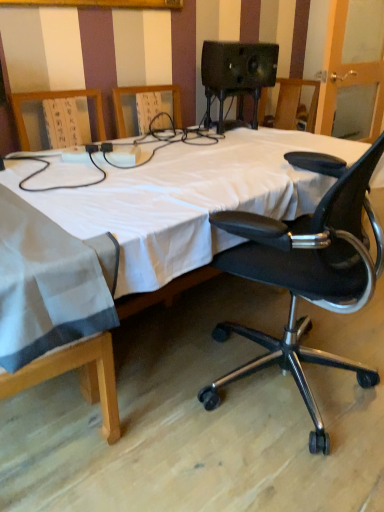
Question: Is white fabric bed at center to the left or to the right of black matte office chair at right in the image?

Choices:
 (A) right
 (B) left

Answer: (B)

Question: From a real-world perspective, is white fabric bed at center positioned above or below black matte office chair at right?

Choices:
 (A) above
 (B) below

Answer: (B)

Question: Relative to black matte office chair at right, is white fabric bed at center in front or behind?

Choices:
 (A) behind
 (B) front

Answer: (B)

Question: Considering the positions of black matte office chair at right and white fabric bed at center in the image, is black matte office chair at right wider or thinner than white fabric bed at center?

Choices:
 (A) wide
 (B) thin

Answer: (B)

Question: In terms of size, does black matte office chair at right appear bigger or smaller than white fabric bed at center?

Choices:
 (A) big
 (B) small

Answer: (B)

Question: Considering the positions of black matte office chair at right and white fabric bed at center in the image, is black matte office chair at right taller or shorter than white fabric bed at center?

Choices:
 (A) tall
 (B) short

Answer: (A)

Question: From the image's perspective, is black matte office chair at right located above or below white fabric bed at center?

Choices:
 (A) below
 (B) above

Answer: (A)